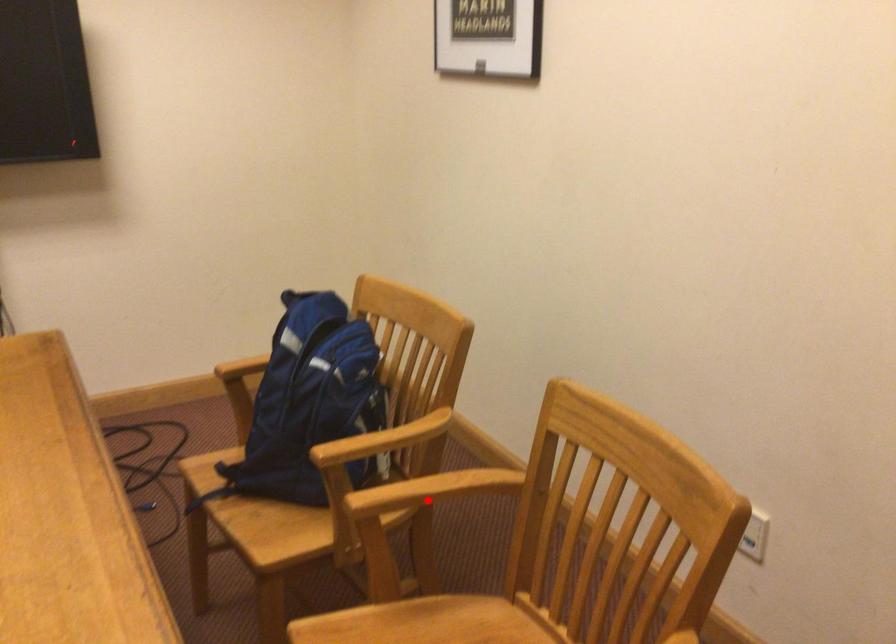
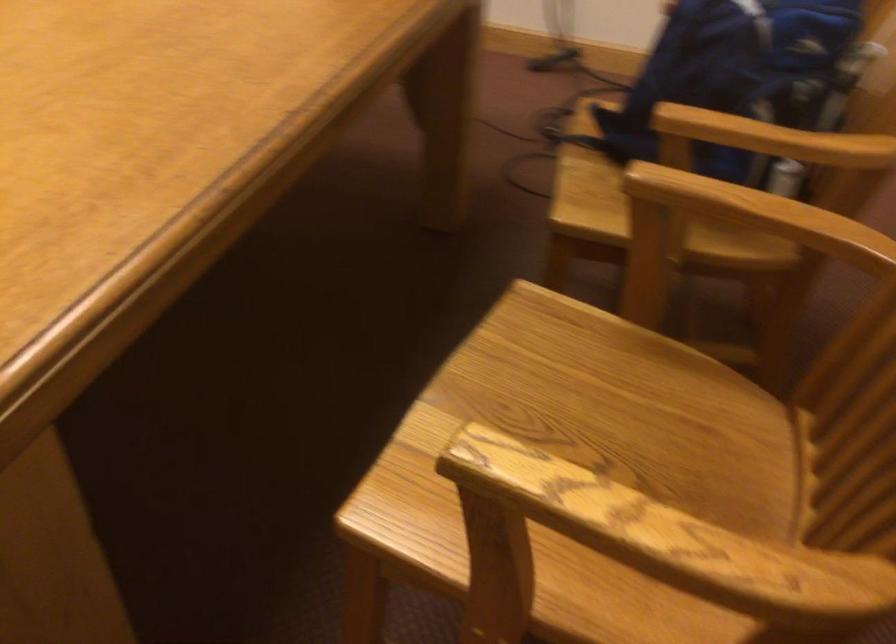
Question: I am providing you with two images of the same scene from different viewpoints. Image1 has a red point marked. In image2, the corresponding 3D location appears at what relative position? Reply with the corresponding letter.

Choices:
 (A) Closer
 (B) Farther

Answer: (A)